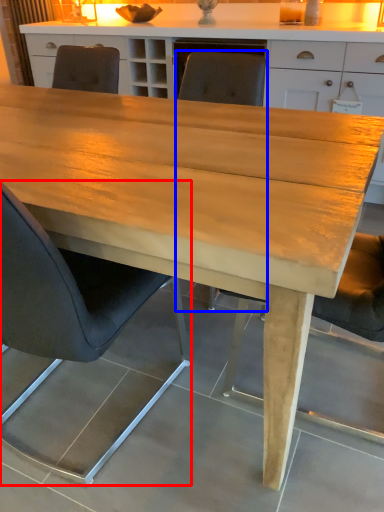
Question: Which of the following is the closest to the observer, chair (highlighted by a red box) or chair (highlighted by a blue box)?

Choices:
 (A) chair
 (B) chair

Answer: (A)